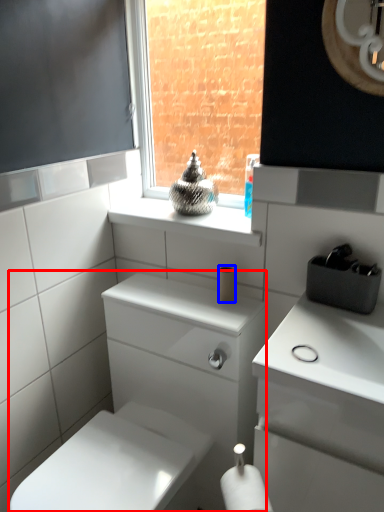
Question: Which point is further to the camera, porcelain (highlighted by a red box) or toilet paper (highlighted by a blue box)?

Choices:
 (A) porcelain
 (B) toilet paper

Answer: (B)